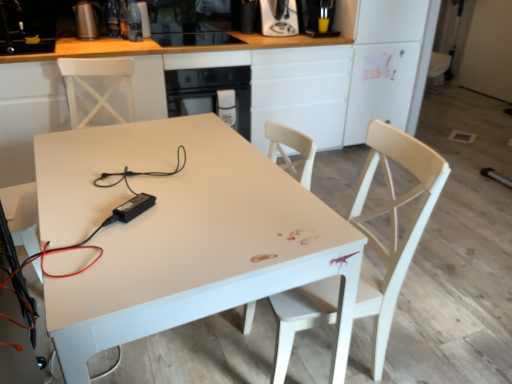
Question: Which direction should I rotate to look at black plastic power adapter at center, acting as the first appliance starting from the front?

Choices:
 (A) right
 (B) left

Answer: (B)

Question: Can you confirm if metallic silver kettle at upper left, acting as the second appliance starting from the top, is bigger than white glossy cabinet at center?

Choices:
 (A) yes
 (B) no

Answer: (B)

Question: From a real-world perspective, does metallic silver kettle at upper left, the third appliance positioned from the right, stand above white glossy cabinet at center?

Choices:
 (A) no
 (B) yes

Answer: (B)

Question: From a real-world perspective, is metallic silver kettle at upper left, the 3th appliance positioned from the front, positioned under white glossy cabinet at center based on gravity?

Choices:
 (A) yes
 (B) no

Answer: (B)

Question: Considering the relative sizes of metallic silver kettle at upper left, the third appliance positioned from the right, and white glossy cabinet at center in the image provided, is metallic silver kettle at upper left, the third appliance positioned from the right, shorter than white glossy cabinet at center?

Choices:
 (A) yes
 (B) no

Answer: (A)

Question: Does metallic silver kettle at upper left, the third appliance positioned from the right, have a greater width compared to white glossy cabinet at center?

Choices:
 (A) yes
 (B) no

Answer: (B)

Question: Is metallic silver kettle at upper left, the 1th appliance in the back-to-front sequence, to the left of white glossy cabinet at center from the viewer's perspective?

Choices:
 (A) no
 (B) yes

Answer: (B)

Question: Is white wood chair at right positioned with its back to white glossy table at center?

Choices:
 (A) no
 (B) yes

Answer: (A)

Question: Is white wood chair at right outside white glossy table at center?

Choices:
 (A) yes
 (B) no

Answer: (B)

Question: Can you confirm if white wood chair at right is thinner than white glossy table at center?

Choices:
 (A) no
 (B) yes

Answer: (B)

Question: Is white wood chair at right positioned before white glossy table at center?

Choices:
 (A) yes
 (B) no

Answer: (B)

Question: Does white wood chair at right contain white glossy table at center?

Choices:
 (A) yes
 (B) no

Answer: (B)

Question: From a real-world perspective, does white wood chair at right sit lower than white glossy table at center?

Choices:
 (A) no
 (B) yes

Answer: (A)

Question: Does white glossy cabinet at center have a lesser height compared to black plastic power adapter at center, which is counted as the 3th appliance, starting from the back?

Choices:
 (A) yes
 (B) no

Answer: (B)